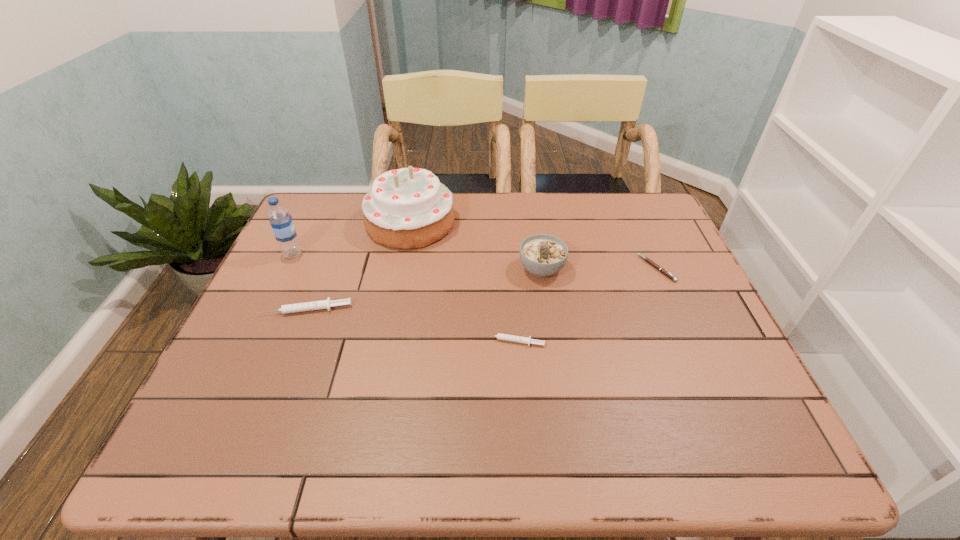
You are a GUI agent. You are given a task and a screenshot of the screen. Output one action in this format:
    pyautogui.click(x=<x>, y=<y>)
    Task: Click on the fourth tallest object
    The height and width of the screenshot is (540, 960).
    Given the screenshot: What is the action you would take?
    pyautogui.click(x=323, y=304)

Locate an element on the screen. This screenshot has height=540, width=960. the farther syringe is located at coordinates (323, 304).

The image size is (960, 540). I want to click on the shorter syringe, so click(512, 338).

Find the location of a particular element. The height and width of the screenshot is (540, 960). the right syringe is located at coordinates (x=512, y=338).

The width and height of the screenshot is (960, 540). In order to click on cake in this screenshot , I will do `click(408, 208)`.

Find the location of a particular element. water bottle is located at coordinates (281, 221).

Locate an element on the screen. The height and width of the screenshot is (540, 960). soup bowl is located at coordinates (543, 255).

Image resolution: width=960 pixels, height=540 pixels. In order to click on the rightmost object in this screenshot , I will do `click(669, 275)`.

Locate an element on the screen. The height and width of the screenshot is (540, 960). pen is located at coordinates (669, 275).

The image size is (960, 540). Identify the location of free spot located 0.100m on the right of the fourth tallest object. (392, 309).